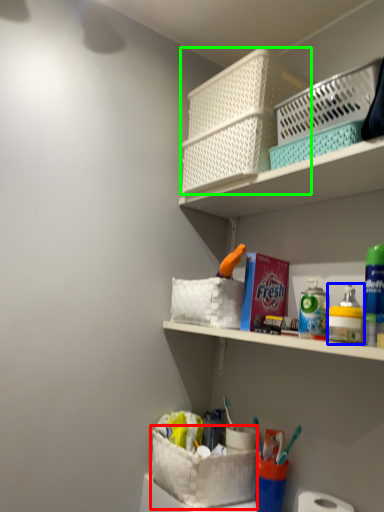
Question: Which object is the closest to the basket container (highlighted by a red box)? Choose among these: toiletry (highlighted by a blue box) or basket container (highlighted by a green box).

Choices:
 (A) toiletry
 (B) basket container

Answer: (A)